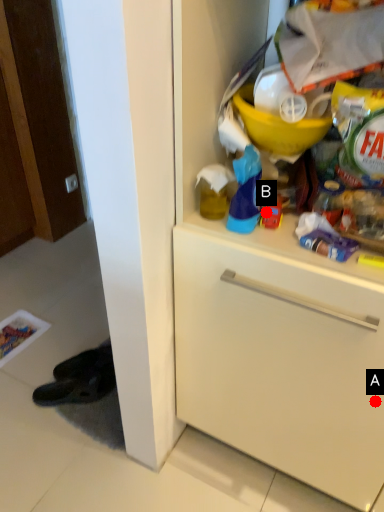
Question: Two points are circled on the image, labeled by A and B beside each circle. Which point appears farthest from the camera in this image?

Choices:
 (A) A is further
 (B) B is further

Answer: (A)